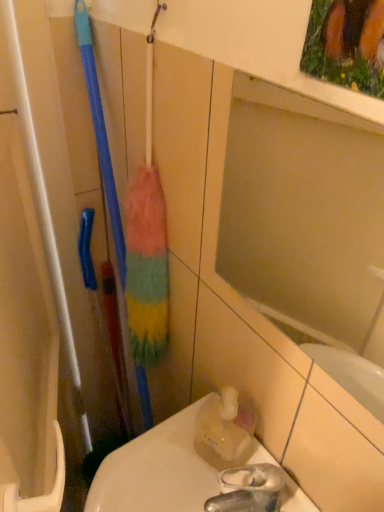
Question: Is translucent plastic toilet at lower right aimed at matte glass mirror at upper center?

Choices:
 (A) yes
 (B) no

Answer: (B)

Question: Is matte glass mirror at upper center located within translucent plastic toilet at lower right?

Choices:
 (A) no
 (B) yes

Answer: (A)

Question: Is translucent plastic toilet at lower right not close to matte glass mirror at upper center?

Choices:
 (A) yes
 (B) no

Answer: (B)

Question: Is translucent plastic toilet at lower right closer to the viewer compared to matte glass mirror at upper center?

Choices:
 (A) yes
 (B) no

Answer: (B)

Question: From the image's perspective, is translucent plastic toilet at lower right over matte glass mirror at upper center?

Choices:
 (A) no
 (B) yes

Answer: (A)

Question: From a real-world perspective, is translucent plastic toilet at lower right beneath matte glass mirror at upper center?

Choices:
 (A) yes
 (B) no

Answer: (A)

Question: Is translucent plastic bottle at lower right facing away from matte glass mirror at upper center?

Choices:
 (A) no
 (B) yes

Answer: (A)

Question: Is translucent plastic bottle at lower right thinner than matte glass mirror at upper center?

Choices:
 (A) no
 (B) yes

Answer: (A)

Question: From the image's perspective, does translucent plastic bottle at lower right appear higher than matte glass mirror at upper center?

Choices:
 (A) no
 (B) yes

Answer: (A)

Question: From the image's perspective, does translucent plastic bottle at lower right appear lower than matte glass mirror at upper center?

Choices:
 (A) no
 (B) yes

Answer: (B)

Question: Is translucent plastic bottle at lower right not inside matte glass mirror at upper center?

Choices:
 (A) yes
 (B) no

Answer: (A)

Question: From a real-world perspective, is translucent plastic bottle at lower right under matte glass mirror at upper center?

Choices:
 (A) yes
 (B) no

Answer: (A)

Question: Is translucent plastic bottle at lower right shorter than translucent plastic toilet at lower right?

Choices:
 (A) yes
 (B) no

Answer: (B)